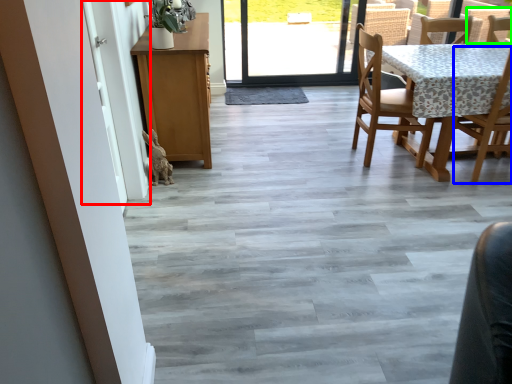
Question: Which is nearer to the screen door (highlighted by a red box)? chair (highlighted by a blue box) or armchair (highlighted by a green box).

Choices:
 (A) chair
 (B) armchair

Answer: (A)